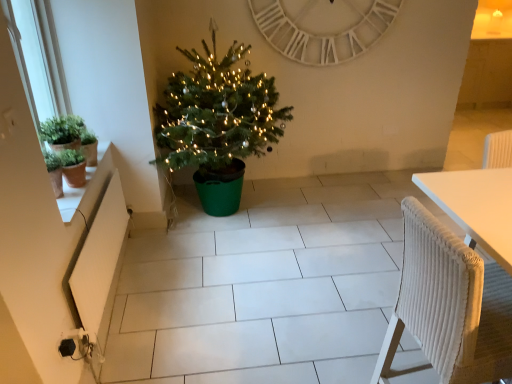
Question: Considering the relative sizes of green plastic christmas tree at center and white matte radiator at lower left in the image provided, is green plastic christmas tree at center shorter than white matte radiator at lower left?

Choices:
 (A) yes
 (B) no

Answer: (B)

Question: Does green plastic christmas tree at center have a larger size compared to white matte radiator at lower left?

Choices:
 (A) no
 (B) yes

Answer: (B)

Question: Is green plastic christmas tree at center outside of white matte radiator at lower left?

Choices:
 (A) yes
 (B) no

Answer: (A)

Question: Does green plastic christmas tree at center turn towards white matte radiator at lower left?

Choices:
 (A) no
 (B) yes

Answer: (A)

Question: Can you confirm if green plastic christmas tree at center is taller than white matte radiator at lower left?

Choices:
 (A) yes
 (B) no

Answer: (A)

Question: From a real-world perspective, is terracotta clay pot at left above or below green plastic christmas tree at center?

Choices:
 (A) below
 (B) above

Answer: (A)

Question: Considering the positions of terracotta clay pot at left and green plastic christmas tree at center in the image, is terracotta clay pot at left taller or shorter than green plastic christmas tree at center?

Choices:
 (A) tall
 (B) short

Answer: (B)

Question: Considering the positions of point (87, 185) and point (181, 92), is point (87, 185) closer or farther from the camera than point (181, 92)?

Choices:
 (A) closer
 (B) farther

Answer: (A)

Question: Which is correct: terracotta clay pot at left is inside green plastic christmas tree at center, or outside of it?

Choices:
 (A) outside
 (B) inside

Answer: (A)

Question: Is green matte pot at left in front of or behind white wooden clock at upper center in the image?

Choices:
 (A) behind
 (B) front

Answer: (B)

Question: Is green matte pot at left situated inside white wooden clock at upper center or outside?

Choices:
 (A) outside
 (B) inside

Answer: (A)

Question: Is point (88, 134) closer or farther from the camera than point (300, 18)?

Choices:
 (A) farther
 (B) closer

Answer: (B)

Question: Is green matte pot at left wider or thinner than white wooden clock at upper center?

Choices:
 (A) wide
 (B) thin

Answer: (A)

Question: Is white matte radiator at lower left situated inside white wooden clock at upper center or outside?

Choices:
 (A) outside
 (B) inside

Answer: (A)

Question: From a real-world perspective, is white matte radiator at lower left physically located above or below white wooden clock at upper center?

Choices:
 (A) above
 (B) below

Answer: (B)